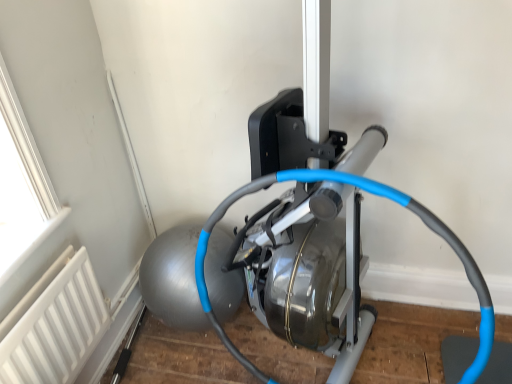
This screenshot has height=384, width=512. What are the coordinates of `vacant region to the right of blue rubber hose at center` in the screenshot? It's located at (417, 348).